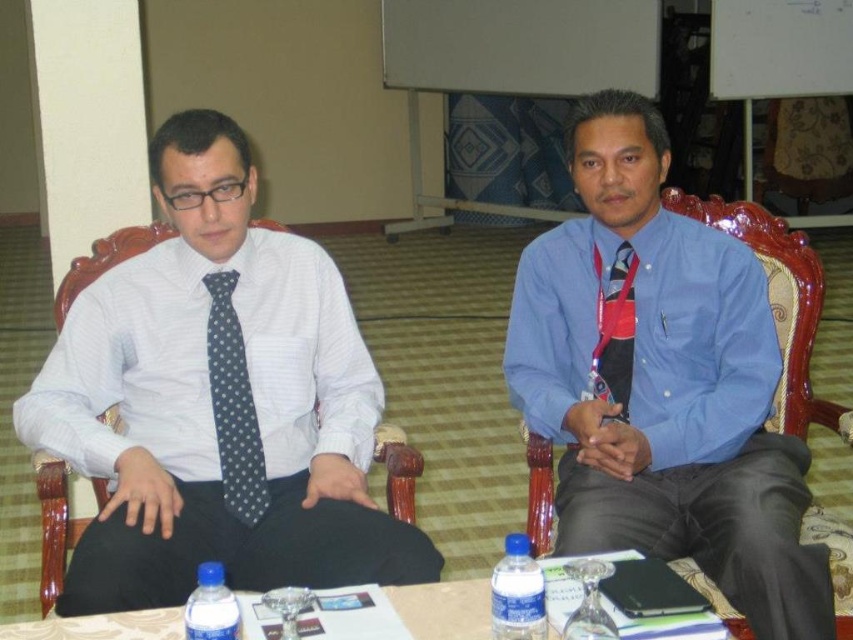
You are a photographer standing at the camera position. You want to place a 1.2 meter long banner between the blue plastic bottle at center and yourself. Is there enough space?

The distance between the blue plastic bottle at center and the camera is 1.04 meters. Since the banner is 1.2 meters long, it would require more space than available. Therefore, the banner cannot be placed between the blue plastic bottle at center and the camera.

Based on the photo, you are a server at a restaurant and need to place two bottles on a table for two guests. The blue plastic bottle at center and the transparent glass bottle at center must be arranged according to their positions in the image. Which bottle should you place on the left side of the table?

The blue plastic bottle at center should be placed on the left side of the table because it is to the left of the transparent glass bottle at center in the image.

You are a photographer setting up for a group photo. You need to ensure that both the blue satin shirt at center and the polka dot fabric tie at center are visible in the frame. Based on their positions, which one should you focus on first to ensure both are in focus?

The blue satin shirt at center is in front of the polka dot fabric tie at center, so you should focus on the blue satin shirt at center first to ensure both are in focus.